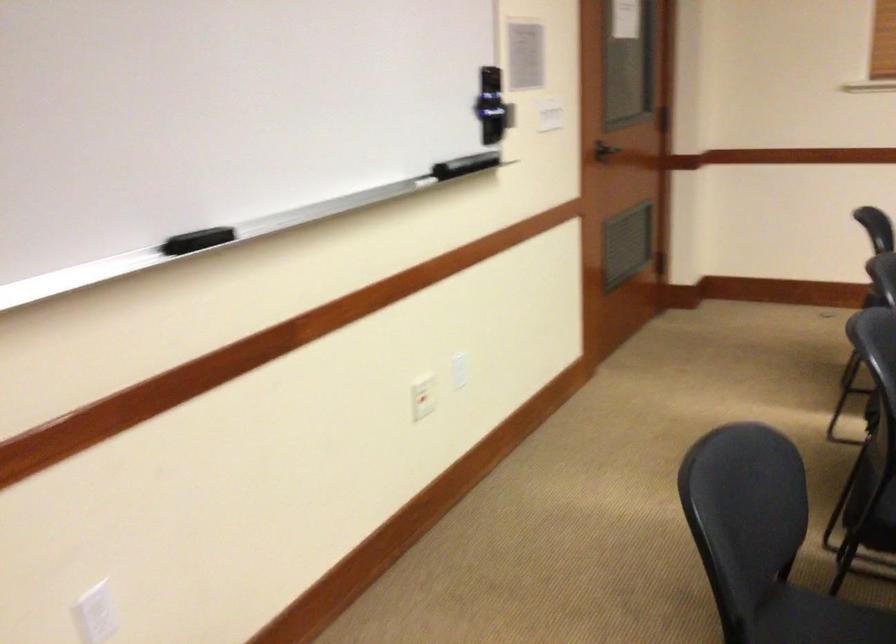
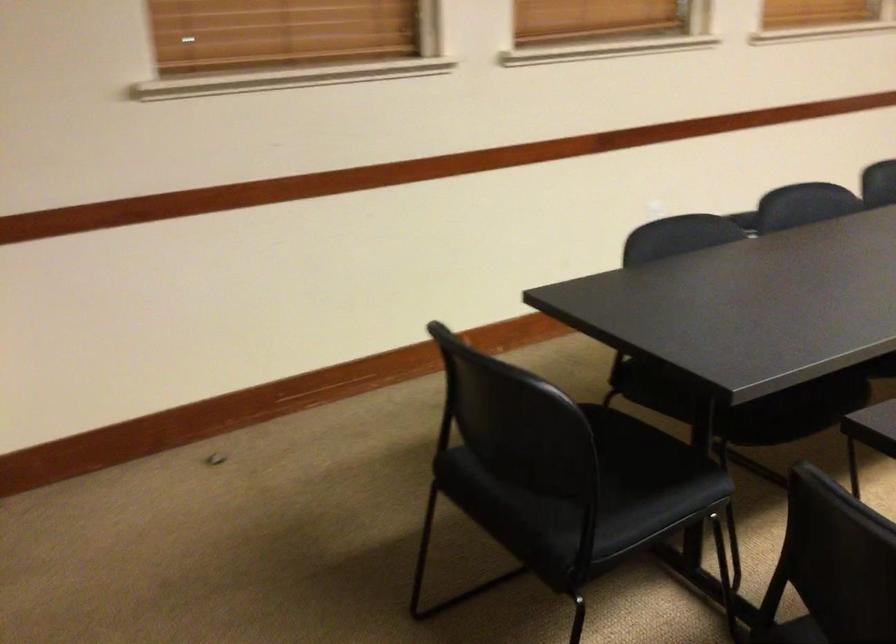
First-person continuous shooting, in which direction is the camera rotating?

The camera's rotation is toward right-down.